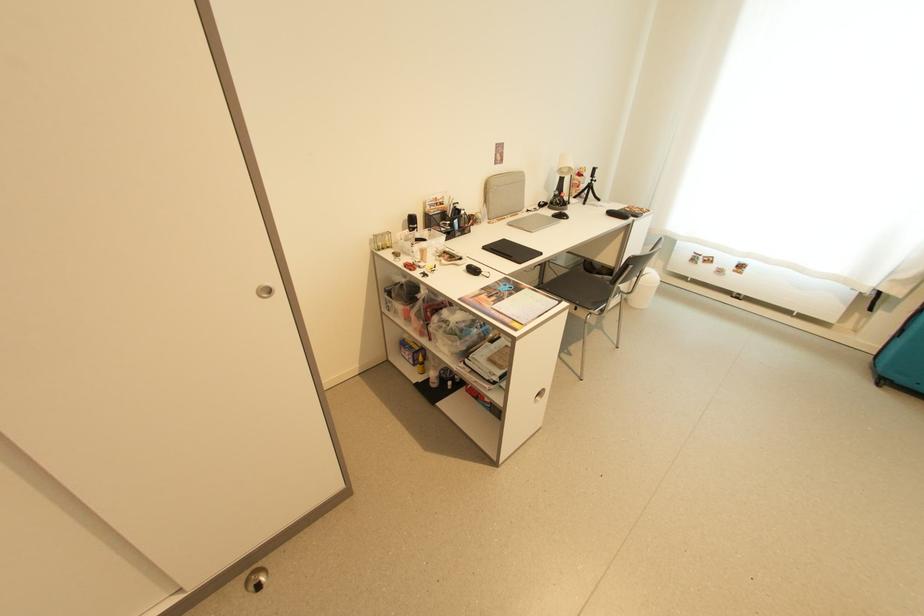
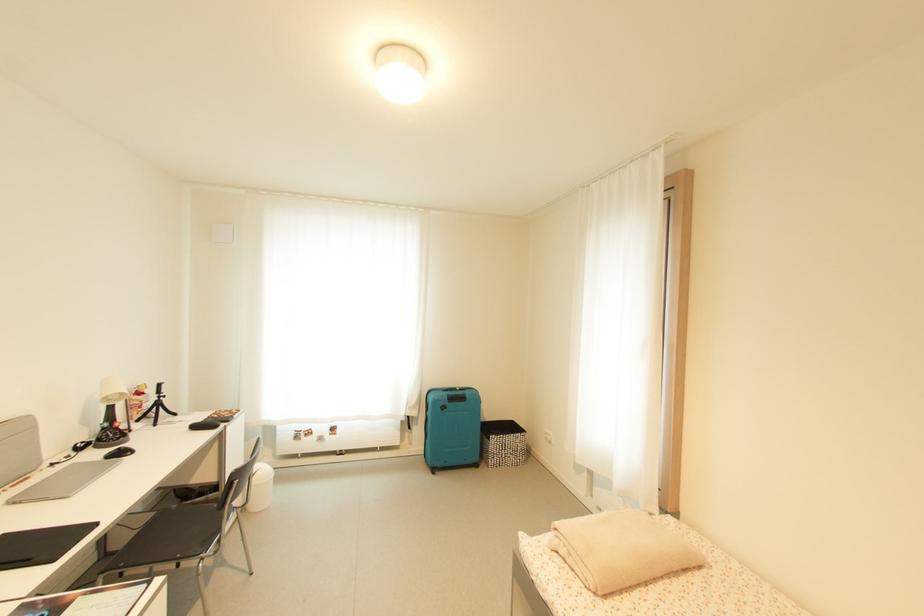
Question: The images are taken continuously from a first-person perspective. In which direction is your viewpoint rotating?

Choices:
 (A) Left
 (B) Right
 (C) Up
 (D) Down

Answer: (B)